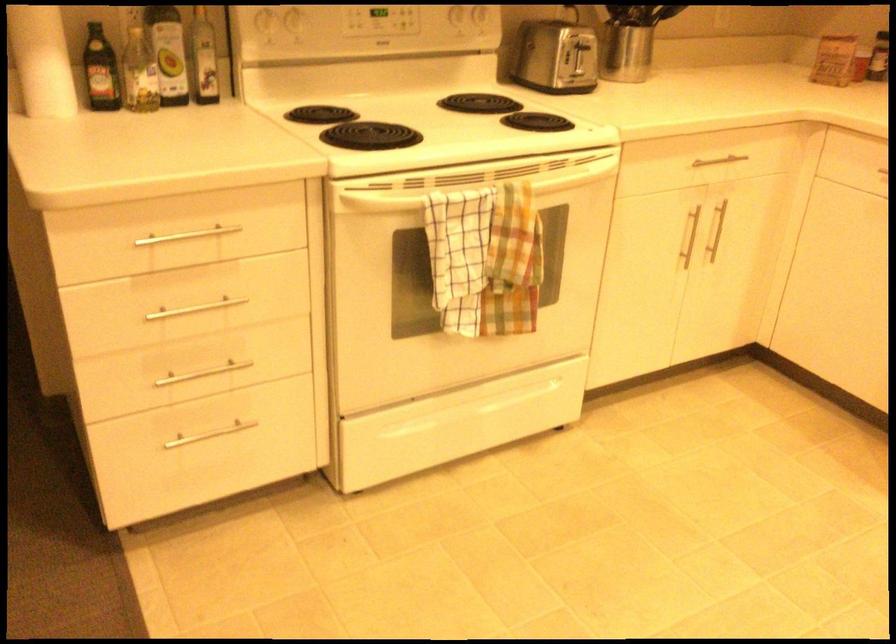
Find where to lift the silver utensil holder. Please return your answer as a coordinate pair (x, y).

(631, 40)